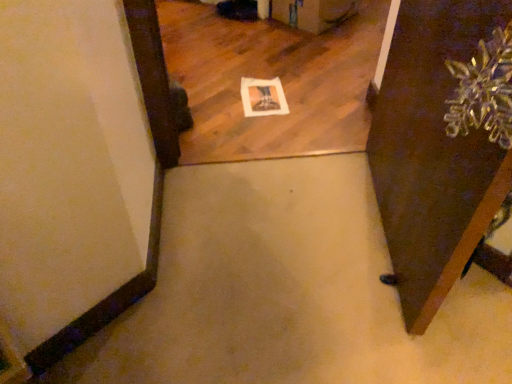
Identify the location of vacant area that is in front of brown wooden door at lower right. (387, 325).